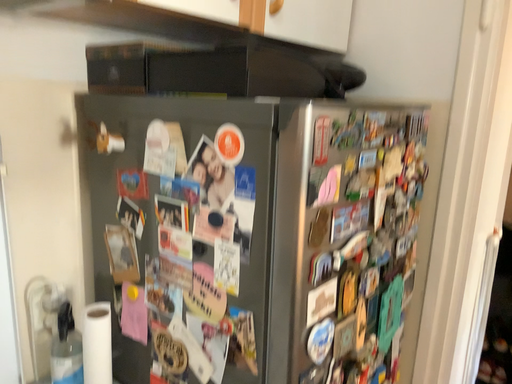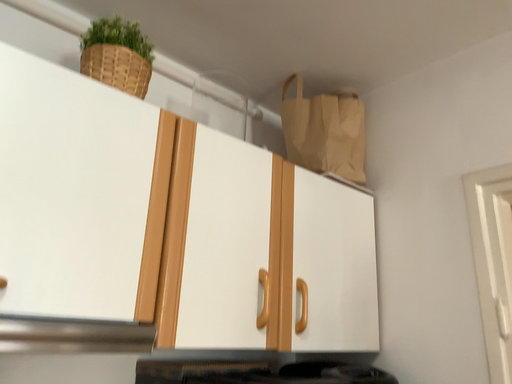
Question: How did the camera likely rotate when shooting the video?

Choices:
 (A) rotated upward
 (B) rotated downward

Answer: (A)